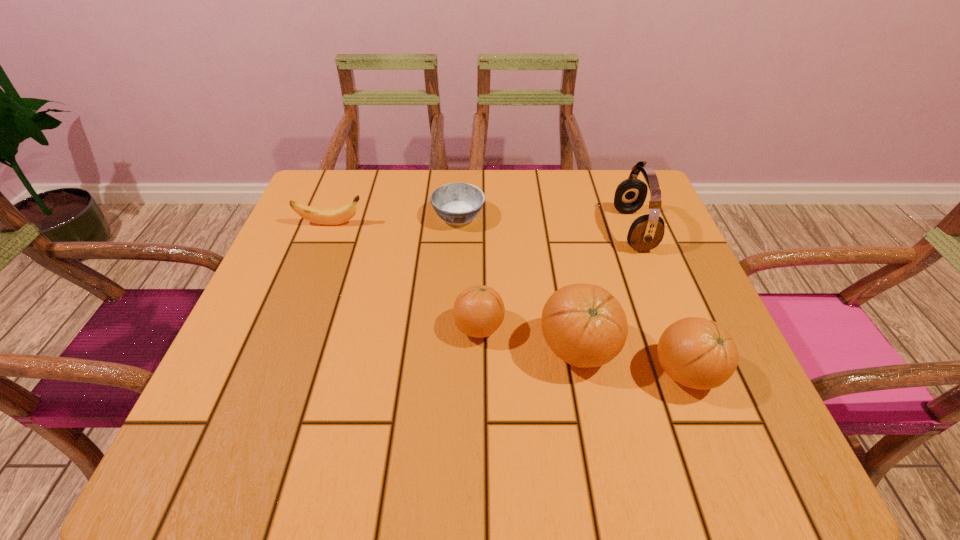
In the current image, all oranges are evenly spaced. To maintain this equal spacing, where should an additional orange be placed on the left? Please point out a free spot. Please provide its 2D coordinates. Your answer should be formatted as a tuple, i.e. [(x, y)], where the tuple contains the x and y coordinates of a point satisfying the conditions above.

[(389, 307)]